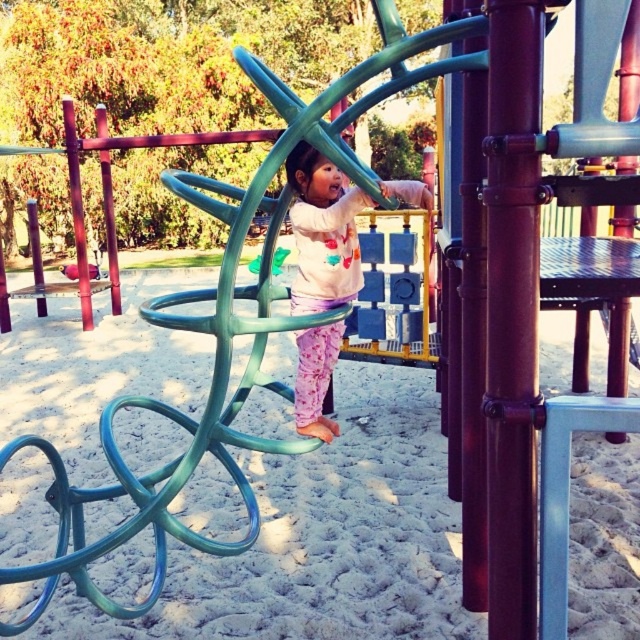
You are a parent watching your child at the playground. You notice the pastel pink fabric pants at center and the white sand at center. Which object is closer to you?

The white sand at center is closer to you because the pastel pink fabric pants at center is behind it.

You are a parent at the playground and see the point marked at coordinates (x=321, y=538). What is located at that point?

The point marked at coordinates (x=321, y=538) marks white sand at center.

You are standing at the point labeled point (305, 340) and want to walk to the point labeled point (451, 598). Which direction should you face to walk straight towards your destination?

You should face forward because point (451, 598) is in front of point (305, 340).